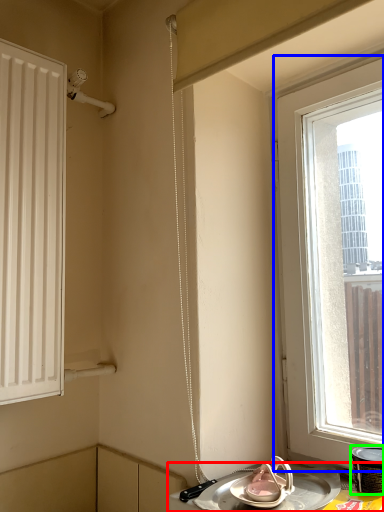
Question: Which is nearer to the table (highlighted by a red box)? window (highlighted by a blue box) or appliance (highlighted by a green box).

Choices:
 (A) window
 (B) appliance

Answer: (B)